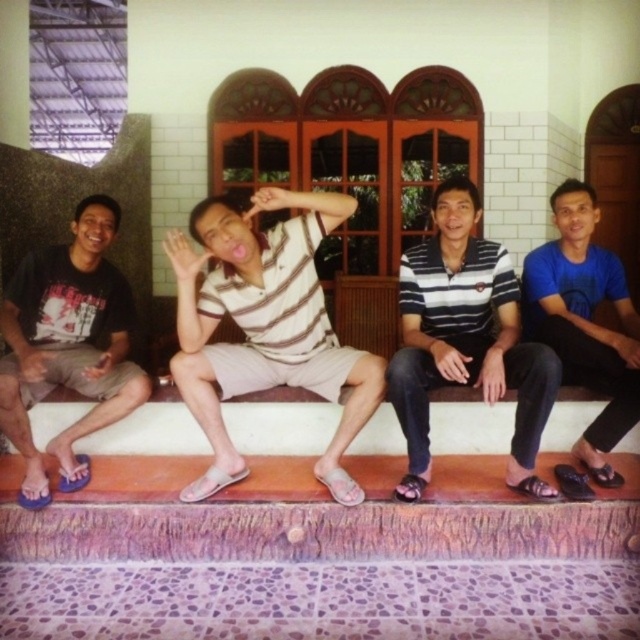
Which of these two, matte black shirt at left or blue fabric shirt at right, stands taller?

Standing taller between the two is blue fabric shirt at right.

Between matte black shirt at left and blue fabric shirt at right, which one appears on the right side from the viewer's perspective?

Positioned to the right is blue fabric shirt at right.

Image resolution: width=640 pixels, height=640 pixels. I want to click on matte black shirt at left, so click(x=67, y=344).

Can you confirm if striped polo shirt at center is shorter than matte black shirt at left?

In fact, striped polo shirt at center may be taller than matte black shirt at left.

In the scene shown: Does striped polo shirt at center have a greater width compared to matte black shirt at left?

Indeed, striped polo shirt at center has a greater width compared to matte black shirt at left.

Does point (435, 364) come farther from viewer compared to point (109, 416)?

No, (435, 364) is in front of (109, 416).

Find the location of a particular element. striped polo shirt at center is located at coordinates (465, 339).

Between striped polo shirt at center and blue fabric shirt at right, which one appears on the right side from the viewer's perspective?

From the viewer's perspective, blue fabric shirt at right appears more on the right side.

Does striped polo shirt at center appear on the right side of blue fabric shirt at right?

In fact, striped polo shirt at center is to the left of blue fabric shirt at right.

Is point (420, 380) in front of point (541, 332)?

Yes, point (420, 380) is closer to viewer.

This screenshot has width=640, height=640. Identify the location of striped polo shirt at center. (465, 339).